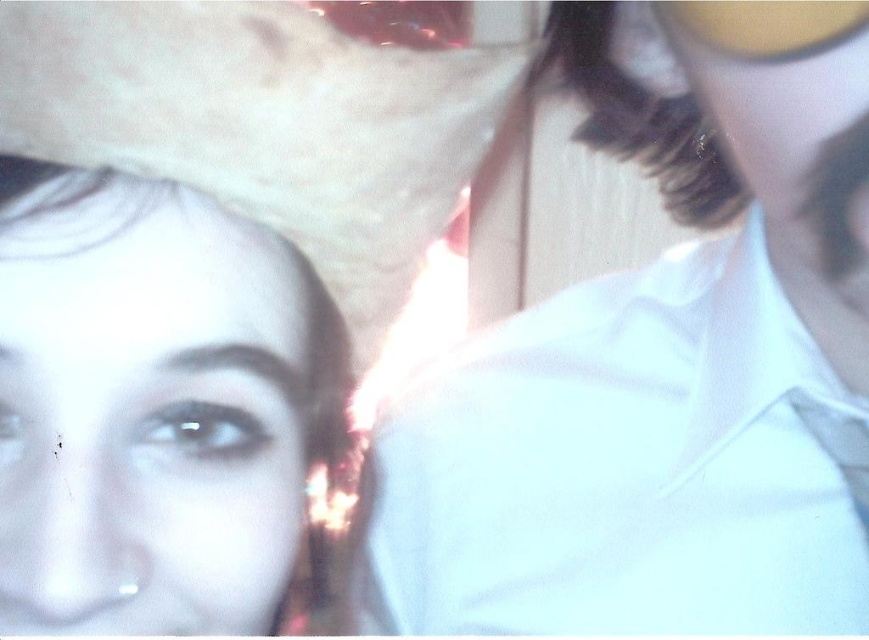
Is smooth skin face at lower left closer to the viewer compared to white felt cowboy hat at upper left?

No, it is behind white felt cowboy hat at upper left.

Consider the image. Is smooth skin face at lower left wider than white felt cowboy hat at upper left?

No.

Does point (90, 593) come in front of point (317, 29)?

That is True.

I want to click on smooth skin face at lower left, so click(147, 410).

Consider the image. Can you confirm if white smooth shirt at upper right is positioned below smooth skin face at lower left?

Incorrect, white smooth shirt at upper right is not positioned below smooth skin face at lower left.

Looking at this image, can you confirm if white smooth shirt at upper right is positioned above smooth skin face at lower left?

Yes.

Does point (861, 243) lie behind point (121, 497)?

Yes, it is behind point (121, 497).

Locate an element on the screen. white smooth shirt at upper right is located at coordinates (661, 364).

Looking at this image, who is shorter, white smooth shirt at upper right or white felt cowboy hat at upper left?

white felt cowboy hat at upper left is shorter.

Does white smooth shirt at upper right have a greater height compared to white felt cowboy hat at upper left?

Indeed, white smooth shirt at upper right has a greater height compared to white felt cowboy hat at upper left.

Between point (608, 481) and point (103, 35), which one is positioned in front?

Positioned in front is point (103, 35).

Find the location of a particular element. white smooth shirt at upper right is located at coordinates (661, 364).